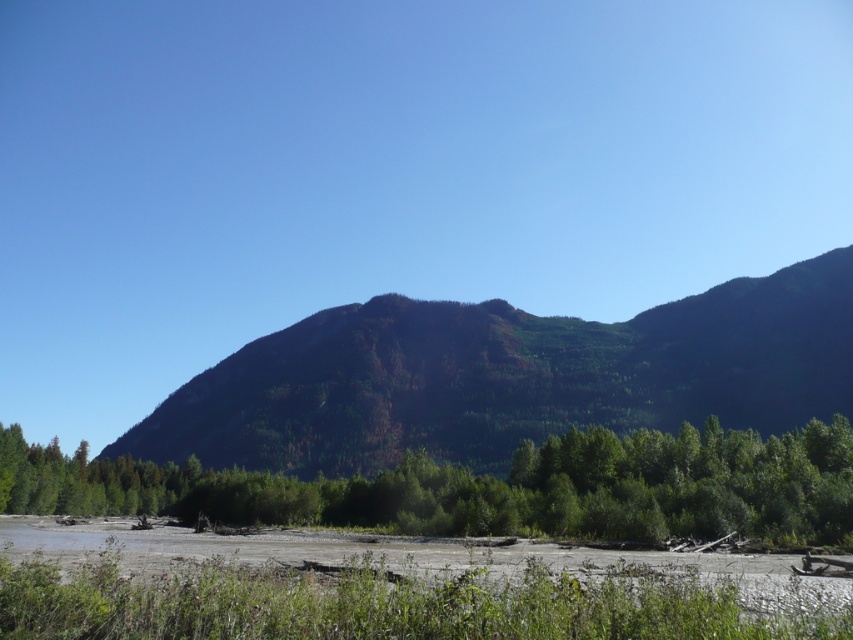
Question: Is green forested mountain at center to the right of green leafy trees at lower center from the viewer's perspective?

Choices:
 (A) yes
 (B) no

Answer: (A)

Question: Does green forested mountain at center appear under green leafy trees at lower center?

Choices:
 (A) no
 (B) yes

Answer: (A)

Question: Which of the following is the closest to the observer?

Choices:
 (A) green leafy trees at lower center
 (B) green forested mountain at center

Answer: (A)

Question: Which point appears farthest from the camera in this image?

Choices:
 (A) (413, 499)
 (B) (605, 376)

Answer: (B)

Question: Does green forested mountain at center appear on the right side of green leafy trees at lower center?

Choices:
 (A) no
 (B) yes

Answer: (B)